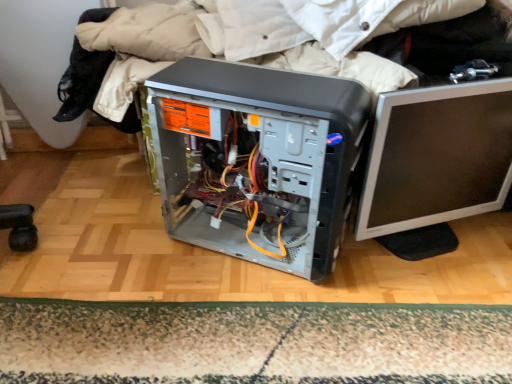
Question: From a real-world perspective, is satin black computer tower at center above or below carpeted mat at lower center?

Choices:
 (A) below
 (B) above

Answer: (B)

Question: From the image's perspective, relative to carpeted mat at lower center, is satin black computer tower at center above or below?

Choices:
 (A) above
 (B) below

Answer: (A)

Question: Considering the real-world distances, which object is farthest from the carpeted mat at lower center?

Choices:
 (A) silver/black plastic monitor at right
 (B) satin black computer tower at center

Answer: (A)

Question: Estimate the real-world distances between objects in this image. Which object is farther from the carpeted mat at lower center?

Choices:
 (A) silver/black plastic monitor at right
 (B) satin black computer tower at center

Answer: (A)